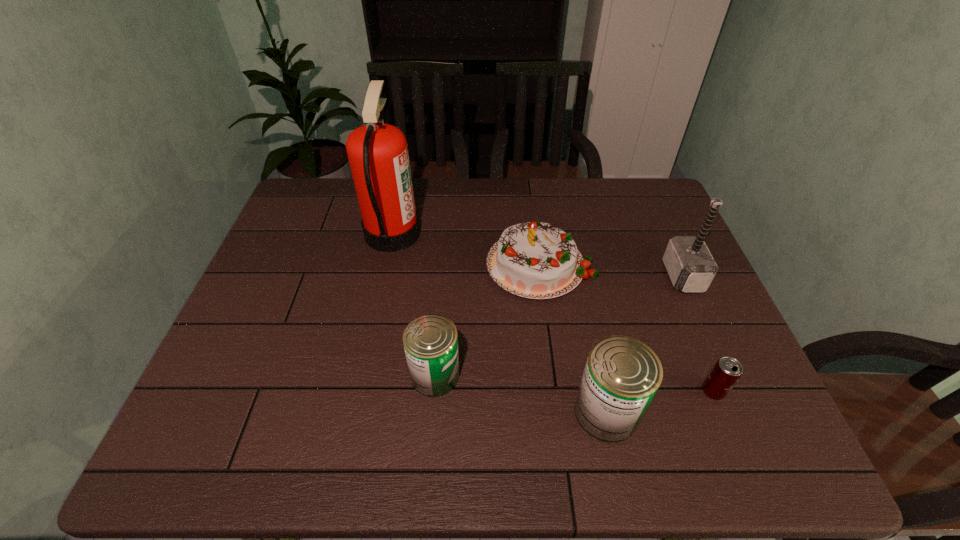
In order to click on object present at the near right corner in this screenshot , I will do `click(726, 372)`.

Where is `vacant space at the far edge of the desktop`? The width and height of the screenshot is (960, 540). vacant space at the far edge of the desktop is located at coordinates (595, 220).

You are a GUI agent. You are given a task and a screenshot of the screen. Output one action in this format:
    pyautogui.click(x=<x>, y=<y>)
    Task: Click on the vacant space at the near edge of the desktop
    
    Given the screenshot: What is the action you would take?
    pyautogui.click(x=482, y=390)

Identify the location of vacant region at the left edge of the desktop. Image resolution: width=960 pixels, height=540 pixels. (300, 292).

What are the coordinates of `vacant space at the right edge` in the screenshot? It's located at tap(661, 235).

The image size is (960, 540). What are the coordinates of `vacant point at the far left corner` in the screenshot? It's located at (300, 204).

Where is `free space between the leftmost object and the left can`? This screenshot has width=960, height=540. free space between the leftmost object and the left can is located at coordinates (414, 304).

Where is `vacant area between the fifth object from right to left and the tallest object`? vacant area between the fifth object from right to left and the tallest object is located at coordinates (414, 304).

Locate an element on the screen. vacant space in between the fifth object from right to left and the hammer is located at coordinates (559, 326).

At what (x,y) coordinates should I click in order to perform the action: click on free space between the cake and the fifth object from right to left. Please return your answer as a coordinate pair (x, y). Image resolution: width=960 pixels, height=540 pixels. Looking at the image, I should click on (488, 320).